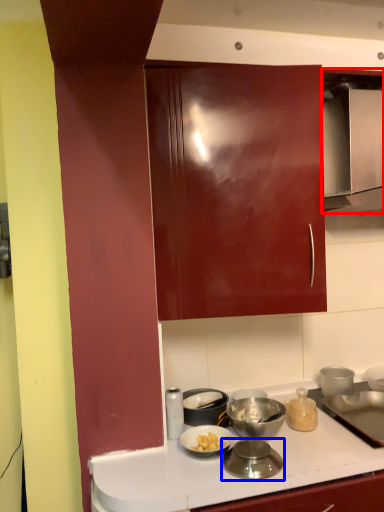
Question: Which of the following is the closest to the observer, home appliance (highlighted by a red box) or kitchen appliance (highlighted by a blue box)?

Choices:
 (A) home appliance
 (B) kitchen appliance

Answer: (B)